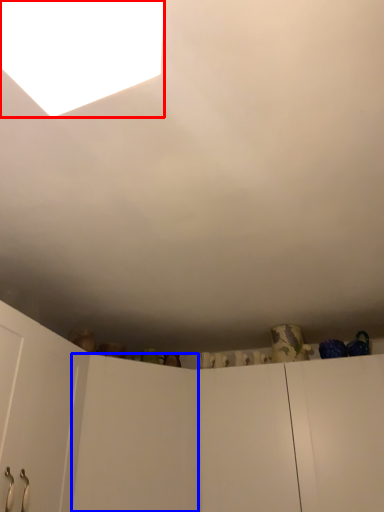
Question: Which object appears farthest to the camera in this image, light (highlighted by a red box) or door (highlighted by a blue box)?

Choices:
 (A) light
 (B) door

Answer: (B)